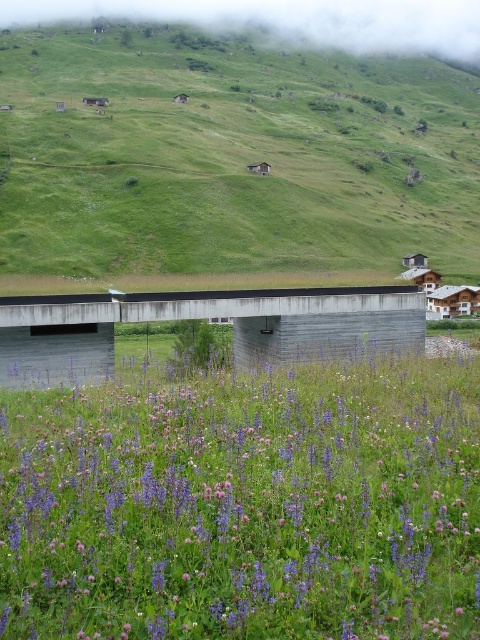
Question: Considering the real-world distances, which object is farthest from the green grassy hillside at upper center?

Choices:
 (A) purple matte flower at center
 (B) smooth concrete bridge at center

Answer: (A)

Question: Which object is positioned farthest from the purple matte flower at center?

Choices:
 (A) green grassy hillside at upper center
 (B) smooth concrete bridge at center

Answer: (A)

Question: Is purple matte flower at center to the left of smooth concrete bridge at center from the viewer's perspective?

Choices:
 (A) yes
 (B) no

Answer: (B)

Question: Among these points, which one is nearest to the camera?

Choices:
 (A) (21, 541)
 (B) (100, 45)
 (C) (337, 298)

Answer: (A)

Question: Is purple matte flower at center behind green grassy hillside at upper center?

Choices:
 (A) yes
 (B) no

Answer: (B)

Question: Does green grassy hillside at upper center appear under smooth concrete bridge at center?

Choices:
 (A) no
 (B) yes

Answer: (A)